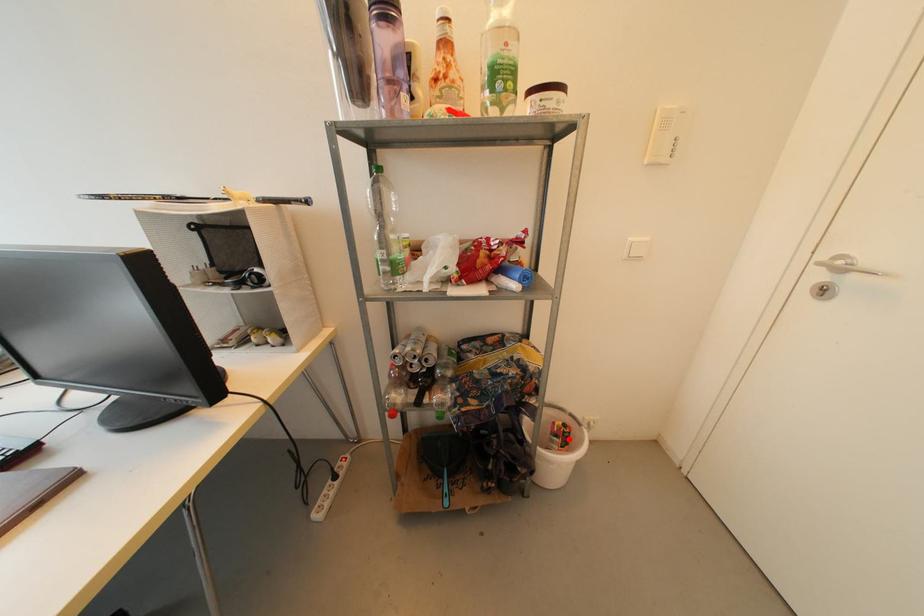
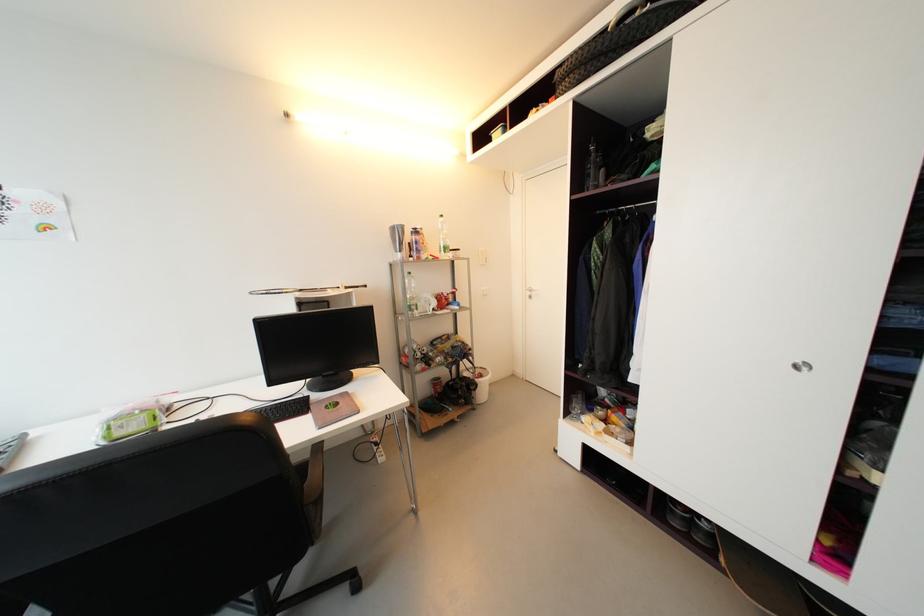
Find the pixel in the second image that matches the highlighted location in the first image.

(487, 378)